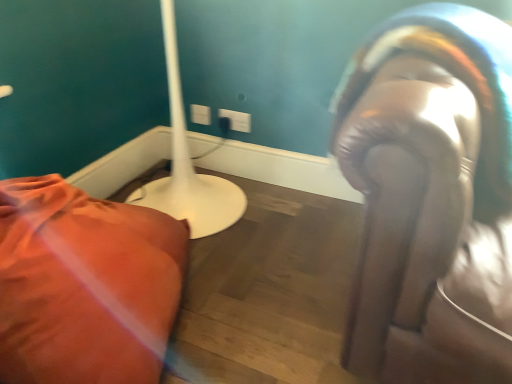
Question: Is matte white lamp at left oriented towards white plastic electric outlet at upper center, which appears as the 1th electric outlet when viewed from the right?

Choices:
 (A) no
 (B) yes

Answer: (A)

Question: Does matte white lamp at left have a greater width compared to white plastic electric outlet at upper center, marked as the second electric outlet in a left-to-right arrangement?

Choices:
 (A) no
 (B) yes

Answer: (B)

Question: From a real-world perspective, is matte white lamp at left positioned over white plastic electric outlet at upper center, marked as the second electric outlet in a left-to-right arrangement, based on gravity?

Choices:
 (A) yes
 (B) no

Answer: (B)

Question: From a real-world perspective, is matte white lamp at left positioned under white plastic electric outlet at upper center, which appears as the 1th electric outlet when viewed from the right, based on gravity?

Choices:
 (A) yes
 (B) no

Answer: (A)

Question: Considering the relative sizes of matte white lamp at left and white plastic electric outlet at upper center, marked as the second electric outlet in a left-to-right arrangement, in the image provided, is matte white lamp at left thinner than white plastic electric outlet at upper center, marked as the second electric outlet in a left-to-right arrangement,?

Choices:
 (A) no
 (B) yes

Answer: (A)

Question: Considering the positions of white plastic electric outlet at upper center, which appears as the first electric outlet when viewed from the left, and white plastic electric outlet at upper center, marked as the second electric outlet in a left-to-right arrangement, in the image, is white plastic electric outlet at upper center, which appears as the first electric outlet when viewed from the left, bigger or smaller than white plastic electric outlet at upper center, marked as the second electric outlet in a left-to-right arrangement,?

Choices:
 (A) big
 (B) small

Answer: (B)

Question: In terms of height, does white plastic electric outlet at upper center, which appears as the first electric outlet when viewed from the left, look taller or shorter compared to white plastic electric outlet at upper center, marked as the second electric outlet in a left-to-right arrangement?

Choices:
 (A) tall
 (B) short

Answer: (A)

Question: Looking at their shapes, would you say white plastic electric outlet at upper center, which appears as the 2th electric outlet when viewed from the right, is wider or thinner than white plastic electric outlet at upper center, marked as the second electric outlet in a left-to-right arrangement?

Choices:
 (A) thin
 (B) wide

Answer: (A)

Question: Considering the relative positions of white plastic electric outlet at upper center, which appears as the first electric outlet when viewed from the left, and white plastic electric outlet at upper center, marked as the second electric outlet in a left-to-right arrangement, in the image provided, is white plastic electric outlet at upper center, which appears as the first electric outlet when viewed from the left, to the left or to the right of white plastic electric outlet at upper center, marked as the second electric outlet in a left-to-right arrangement,?

Choices:
 (A) left
 (B) right

Answer: (A)

Question: Does point (458, 261) appear closer or farther from the camera than point (202, 109)?

Choices:
 (A) farther
 (B) closer

Answer: (B)

Question: Do you think leather-like glove at right is within white plastic electric outlet at upper center, which appears as the first electric outlet when viewed from the left, or outside of it?

Choices:
 (A) outside
 (B) inside

Answer: (A)

Question: From the image's perspective, is leather-like glove at right positioned above or below white plastic electric outlet at upper center, which appears as the 2th electric outlet when viewed from the right?

Choices:
 (A) below
 (B) above

Answer: (A)

Question: Is leather-like glove at right wider or thinner than white plastic electric outlet at upper center, which appears as the 2th electric outlet when viewed from the right?

Choices:
 (A) wide
 (B) thin

Answer: (A)

Question: Considering the positions of white plastic electric outlet at upper center, which appears as the 1th electric outlet when viewed from the right, and matte white lamp at left in the image, is white plastic electric outlet at upper center, which appears as the 1th electric outlet when viewed from the right, wider or thinner than matte white lamp at left?

Choices:
 (A) thin
 (B) wide

Answer: (A)

Question: Would you say white plastic electric outlet at upper center, marked as the second electric outlet in a left-to-right arrangement, is to the left or to the right of matte white lamp at left in the picture?

Choices:
 (A) left
 (B) right

Answer: (B)